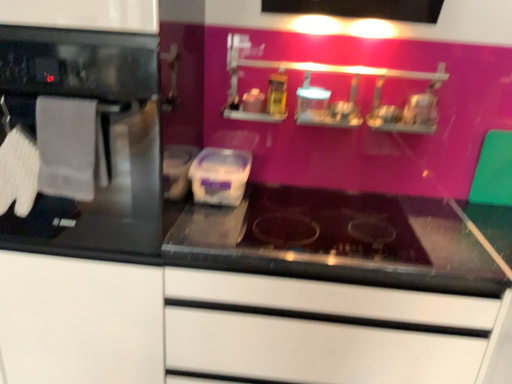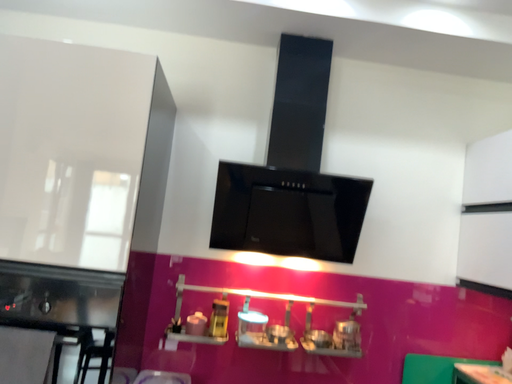
Question: How did the camera likely rotate when shooting the video?

Choices:
 (A) rotated left
 (B) rotated right

Answer: (B)